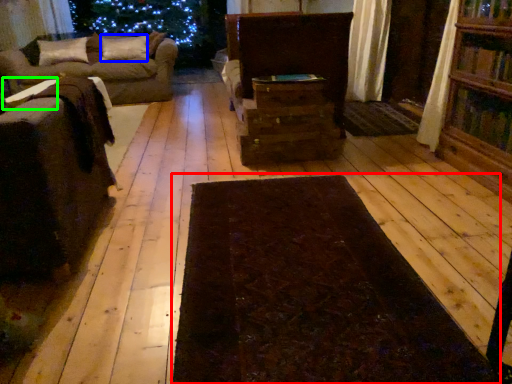
Question: Estimate the real-world distances between objects in this image. Which object is closer to mat (highlighted by a red box), pillow (highlighted by a blue box) or table (highlighted by a green box)?

Choices:
 (A) pillow
 (B) table

Answer: (B)